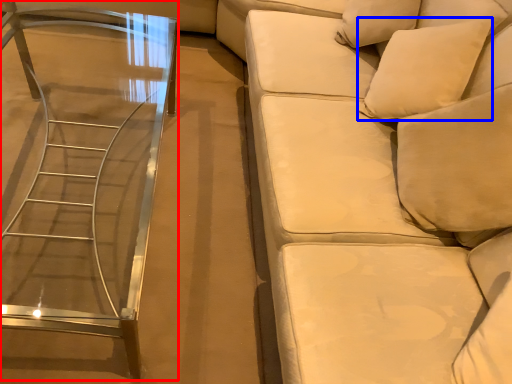
Question: Which point is further to the camera, table (highlighted by a red box) or pillow (highlighted by a blue box)?

Choices:
 (A) table
 (B) pillow

Answer: (B)